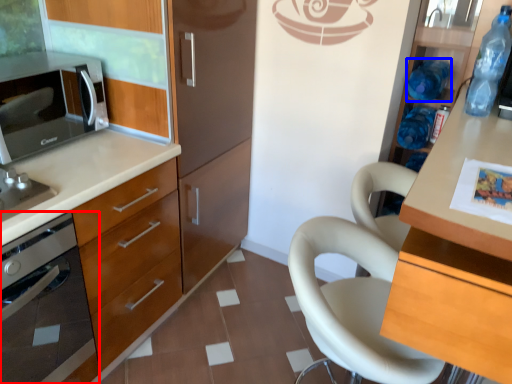
Question: Which object is closer to the camera taking this photo, home appliance (highlighted by a red box) or bottle (highlighted by a blue box)?

Choices:
 (A) home appliance
 (B) bottle

Answer: (A)